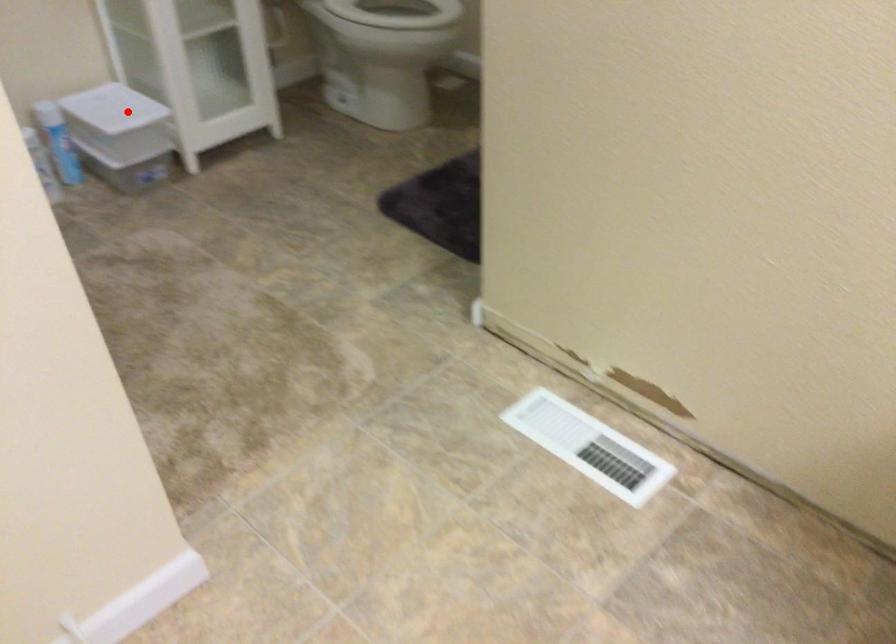
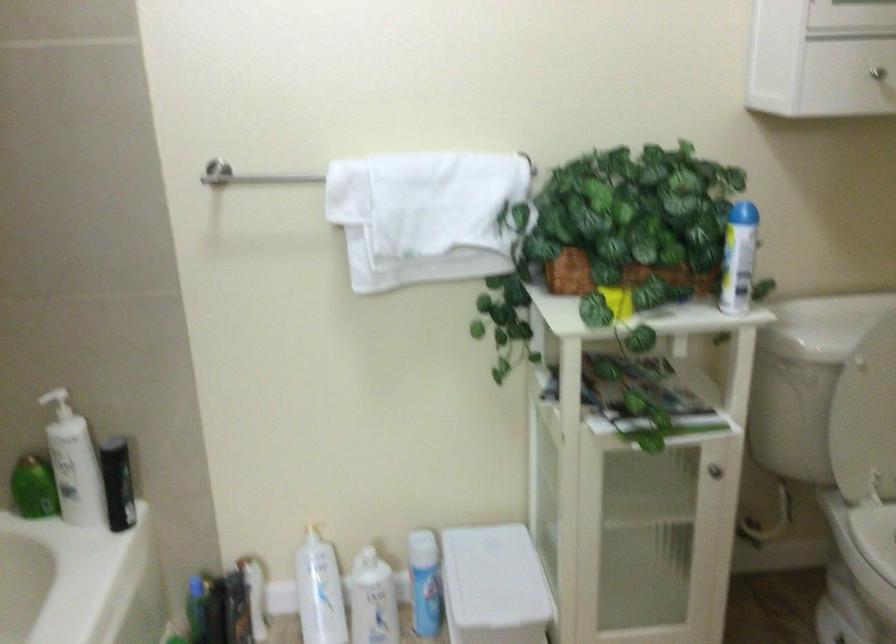
Find the pixel in the second image that matches the highlighted location in the first image.

(493, 580)